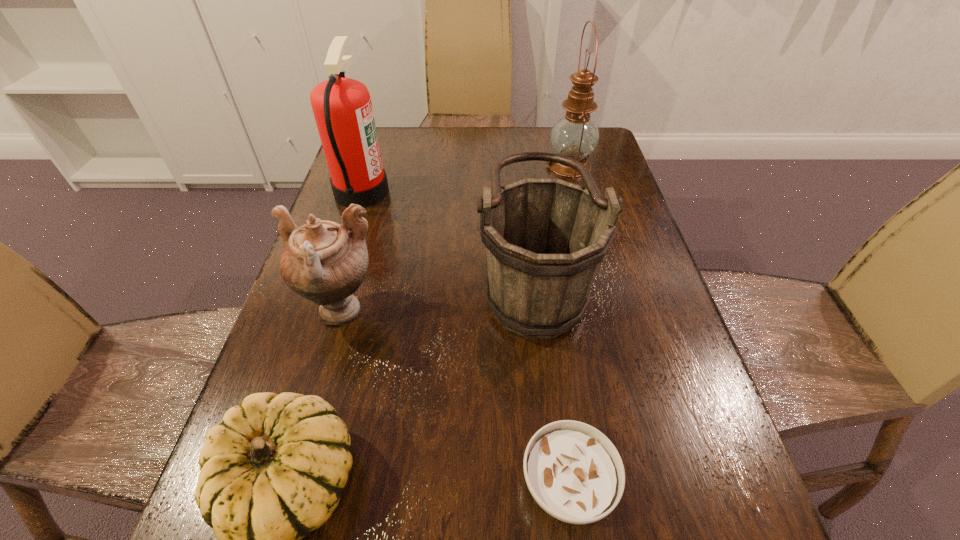
Locate an element on the screen. vacant region located on the back of the urn is located at coordinates click(357, 252).

Find the location of `vacant region located on the right of the shortest object`. vacant region located on the right of the shortest object is located at coordinates (719, 484).

At what (x,y) coordinates should I click in order to perform the action: click on oil lamp that is positioned at the far edge. Please return your answer as a coordinate pair (x, y). The width and height of the screenshot is (960, 540). Looking at the image, I should click on (575, 135).

Locate an element on the screen. This screenshot has height=540, width=960. fire extinguisher present at the far edge is located at coordinates (342, 107).

I want to click on fire extinguisher situated at the left edge, so click(x=342, y=107).

In order to click on urn that is at the left edge in this screenshot , I will do `click(322, 261)`.

At what (x,y) coordinates should I click in order to perform the action: click on oil lamp that is at the right edge. Please return your answer as a coordinate pair (x, y). Image resolution: width=960 pixels, height=540 pixels. Looking at the image, I should click on (575, 135).

Locate an element on the screen. The width and height of the screenshot is (960, 540). bucket located in the right edge section of the desktop is located at coordinates (545, 239).

The height and width of the screenshot is (540, 960). What are the coordinates of `object positioned at the far left corner` in the screenshot? It's located at (342, 107).

Where is `object present at the far right corner`? Image resolution: width=960 pixels, height=540 pixels. object present at the far right corner is located at coordinates (575, 135).